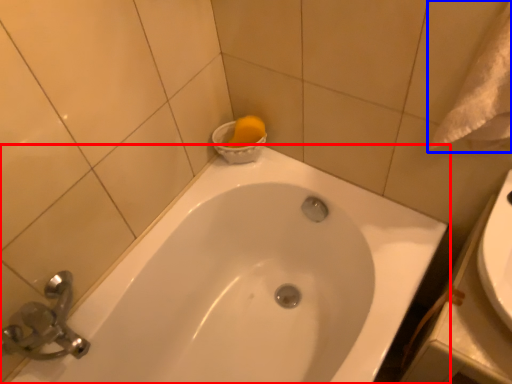
Question: Among these objects, which one is nearest to the camera, bathtub (highlighted by a red box) or bath towel (highlighted by a blue box)?

Choices:
 (A) bathtub
 (B) bath towel

Answer: (B)